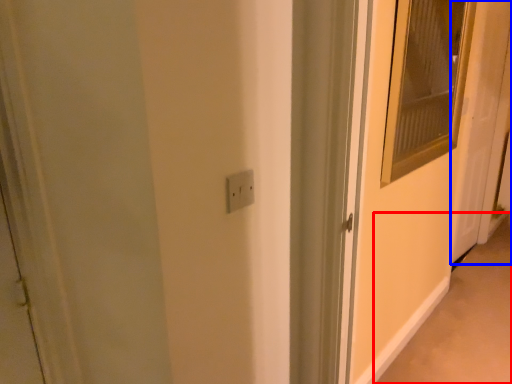
Question: Which of the following is the farthest to the observer, alley (highlighted by a red box) or door (highlighted by a blue box)?

Choices:
 (A) alley
 (B) door

Answer: (B)